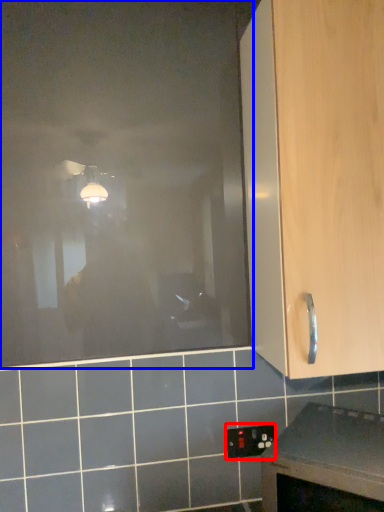
Question: Among these objects, which one is nearest to the camera, electric outlet (highlighted by a red box) or glass door (highlighted by a blue box)?

Choices:
 (A) electric outlet
 (B) glass door

Answer: (B)